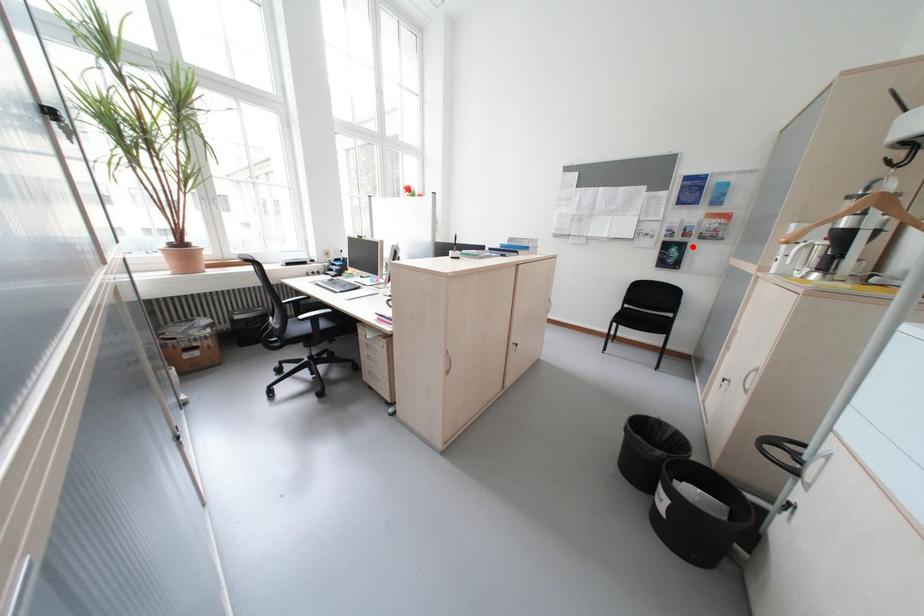
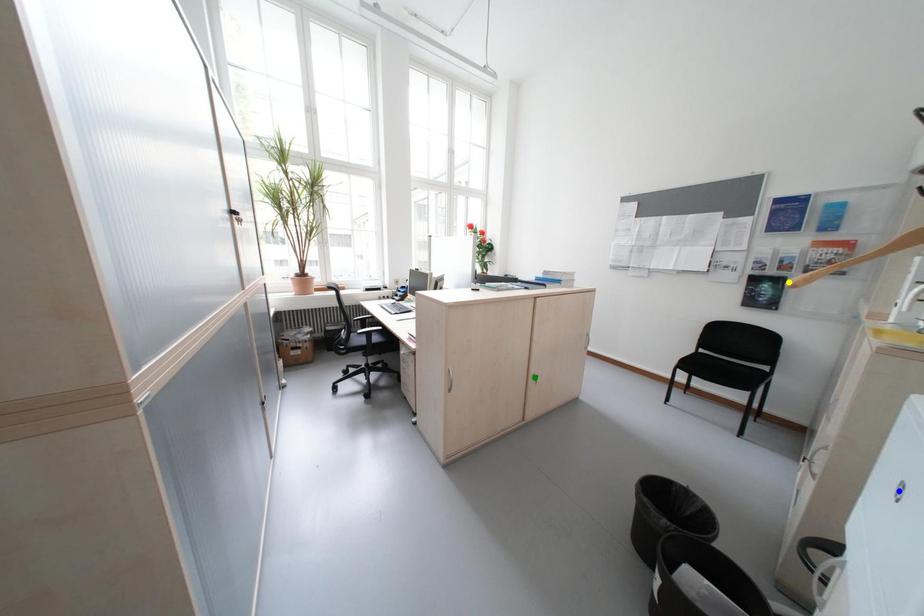
Question: I am providing you with two images of the same scene from different viewpoints. A red point is marked on the first image. You are given multiple points on the second image. Which point in image 2 is actually the same real-world point as the red point in image 1?

Choices:
 (A) green point
 (B) yellow point
 (C) blue point

Answer: (B)